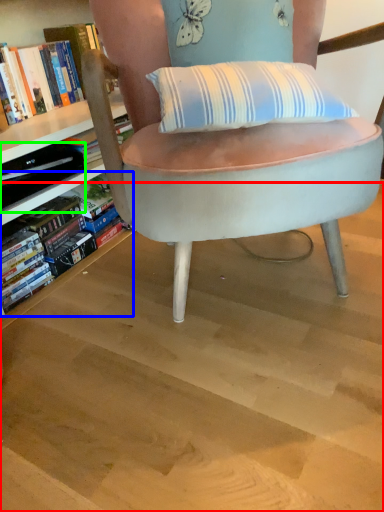
Question: Estimate the real-world distances between objects in this image. Which object is closer to stairwell (highlighted by a red box), book (highlighted by a blue box) or paperback book (highlighted by a green box)?

Choices:
 (A) book
 (B) paperback book

Answer: (A)